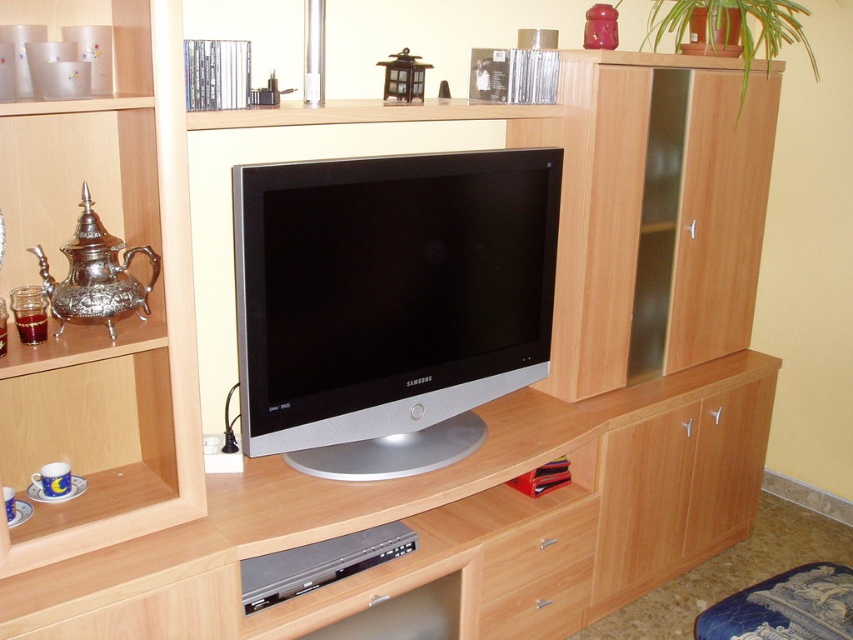
Who is lower down, satin silver flat at center or matte silver teapot at left?

satin silver flat at center is below.

Does point (492, 243) lie behind point (28, 422)?

Yes, point (492, 243) is farther from viewer.

Is point (473, 308) positioned behind point (33, 356)?

Yes.

Image resolution: width=853 pixels, height=640 pixels. Find the location of `satin silver flat at center`. satin silver flat at center is located at coordinates [x=389, y=304].

Can you confirm if matte silver teapot at left is positioned to the right of wooden drawer at lower center?

Incorrect, matte silver teapot at left is not on the right side of wooden drawer at lower center.

Which of these two, matte silver teapot at left or wooden drawer at lower center, stands taller?

Standing taller between the two is matte silver teapot at left.

The width and height of the screenshot is (853, 640). I want to click on matte silver teapot at left, so (x=114, y=321).

Based on the photo, does satin silver flat at center appear on the left side of wooden drawer at lower center?

Indeed, satin silver flat at center is positioned on the left side of wooden drawer at lower center.

Is point (479, 289) positioned before point (527, 598)?

Yes, point (479, 289) is closer to viewer.

Does point (399, 346) come in front of point (573, 570)?

Yes, point (399, 346) is closer to viewer.

Image resolution: width=853 pixels, height=640 pixels. What are the coordinates of `satin silver flat at center` in the screenshot? It's located at (389, 304).